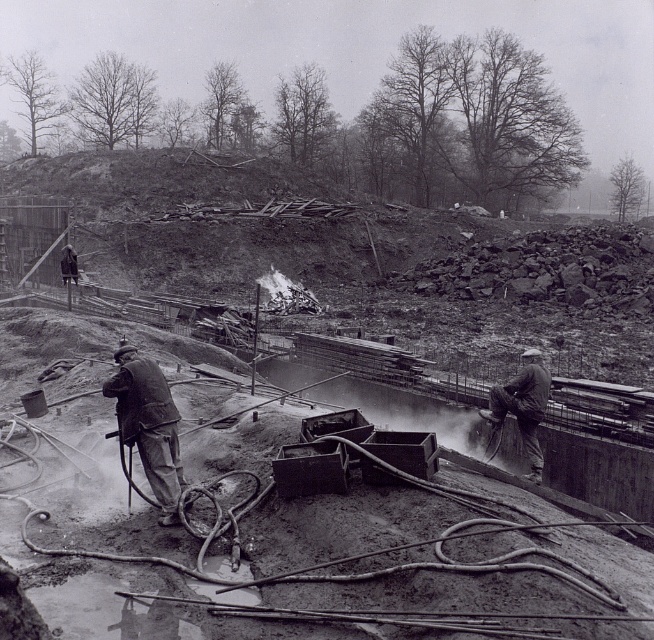
Question: Which point is closer to the camera?

Choices:
 (A) matte gray jacket at right
 (B) matte gray jacket at center

Answer: (B)

Question: Which object is closer to the camera taking this photo?

Choices:
 (A) matte gray jacket at center
 (B) matte gray jacket at right

Answer: (A)

Question: Where is matte gray jacket at center located in relation to matte gray jacket at right in the image?

Choices:
 (A) below
 (B) above

Answer: (A)

Question: Can you confirm if matte gray jacket at center is positioned below matte gray jacket at right?

Choices:
 (A) yes
 (B) no

Answer: (A)

Question: Considering the relative positions of matte gray jacket at center and matte gray jacket at right in the image provided, where is matte gray jacket at center located with respect to matte gray jacket at right?

Choices:
 (A) right
 (B) left

Answer: (B)